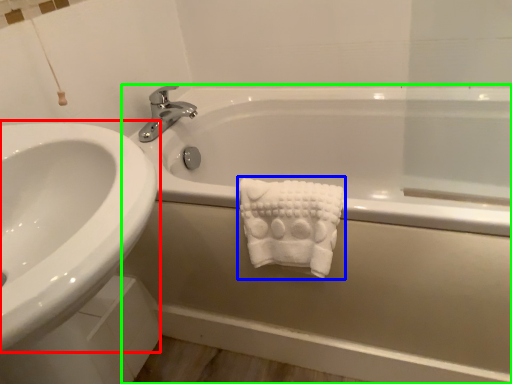
Question: Which object is positioned closest to sink (highlighted by a red box)? Select from bath towel (highlighted by a blue box) and bathtub (highlighted by a green box).

Choices:
 (A) bath towel
 (B) bathtub

Answer: (A)